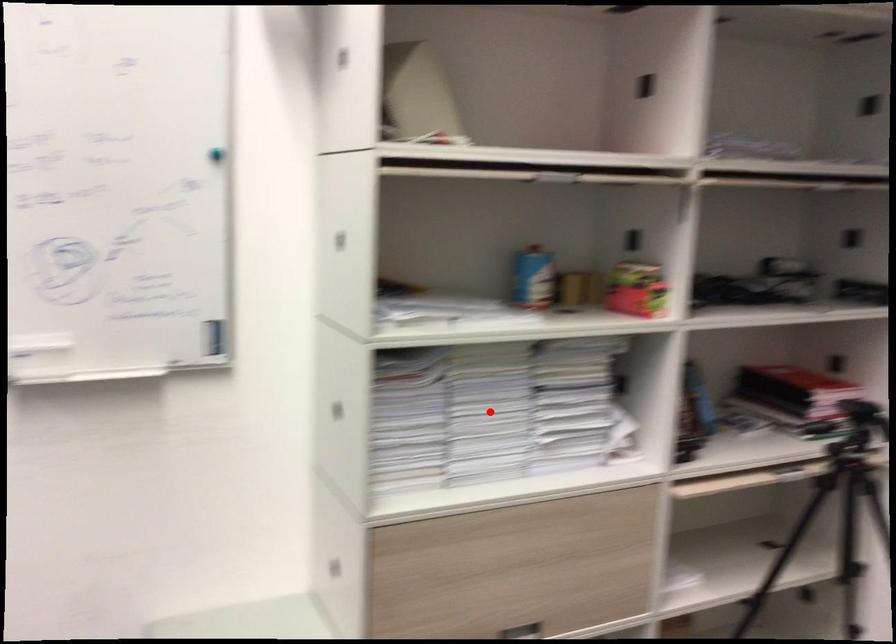
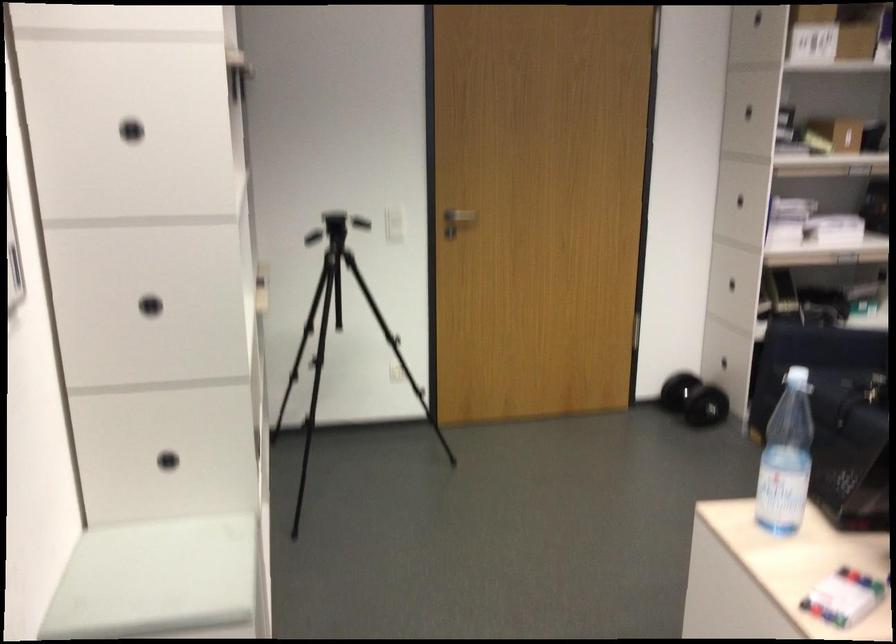
Question: I am providing you with two images of the same scene from different viewpoints. A red point is marked on the first image. Is the red point's position out of view in image 2?

Choices:
 (A) Yes
 (B) No

Answer: (A)